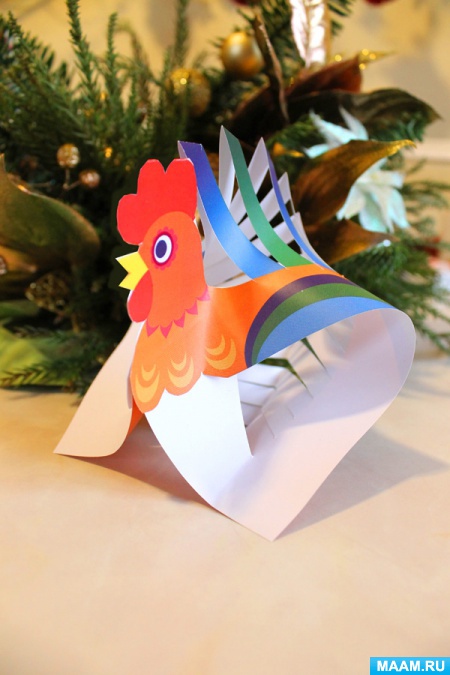
Where is `table`? table is located at coordinates (138, 570).